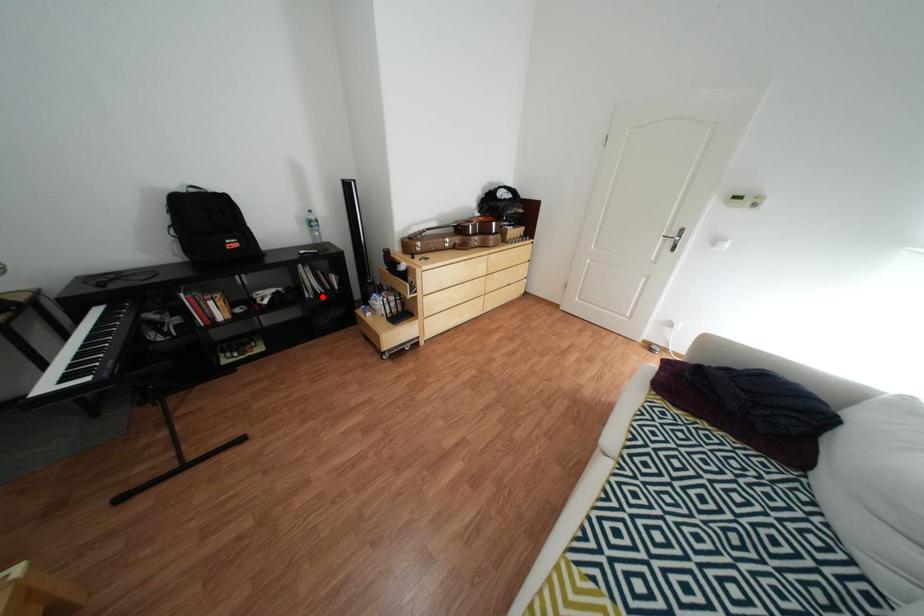
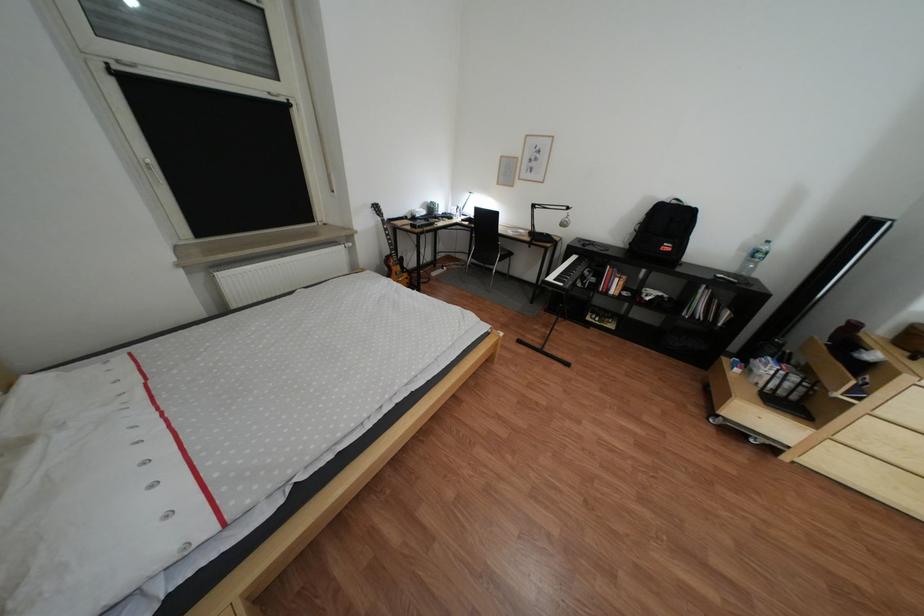
Question: I am providing you with two images of the same scene from different viewpoints. In image1, a red point is highlighted. Considering the same 3D point in image2, which of the following is correct?

Choices:
 (A) It is closer
 (B) It is farther

Answer: (B)